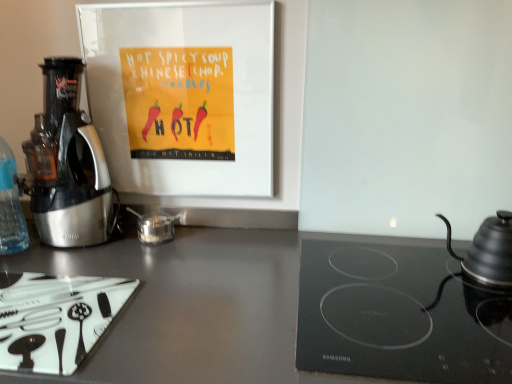
This screenshot has width=512, height=384. Identify the location of free space to the left of transparent glass tea pot at center. (96, 246).